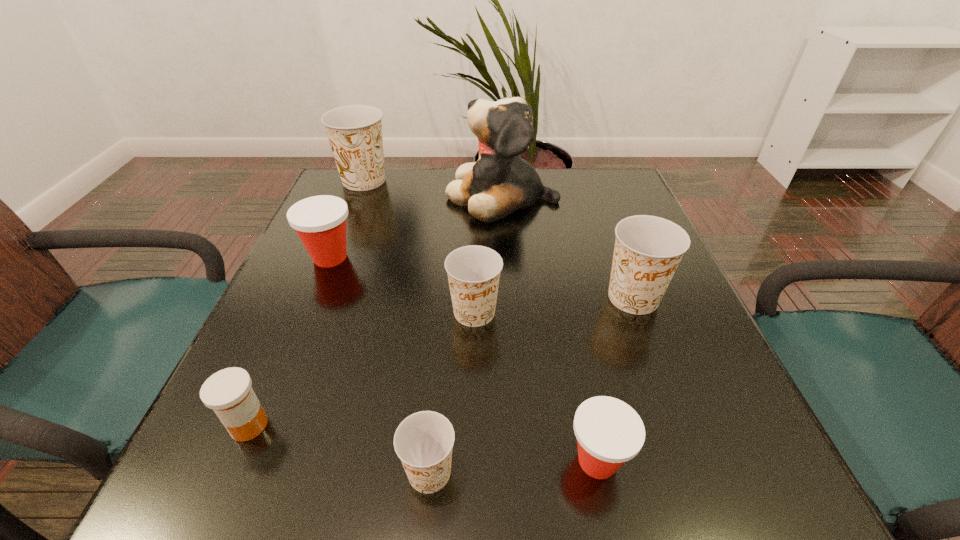
Locate an element on the screen. free spot located 0.350m on the left of the second Dixie cup from right to left is located at coordinates (314, 461).

This screenshot has height=540, width=960. What are the coordinates of `vacant space situated 0.110m on the right of the smallest orange Dixie cup` in the screenshot? It's located at (539, 472).

The height and width of the screenshot is (540, 960). In order to click on puppy that is at the far edge in this screenshot , I will do `click(500, 182)`.

Where is `Dixie cup located at the far edge`? Dixie cup located at the far edge is located at coordinates (354, 132).

Locate an element on the screen. This screenshot has width=960, height=540. medicine present at the near edge is located at coordinates (228, 392).

I want to click on medicine at the left edge, so click(x=228, y=392).

Locate an element on the screen. This screenshot has width=960, height=540. object present at the right edge is located at coordinates pos(648,249).

Find the location of a particular element. object located at the far left corner is located at coordinates (354, 132).

Locate an element on the screen. object at the near left corner is located at coordinates (228, 392).

You are a GUI agent. You are given a task and a screenshot of the screen. Output one action in this format:
    pyautogui.click(x=<x>, y=<y>)
    Task: Click on the free location at the near edge of the desktop
    This screenshot has width=960, height=540.
    Given the screenshot: What is the action you would take?
    pyautogui.click(x=451, y=488)